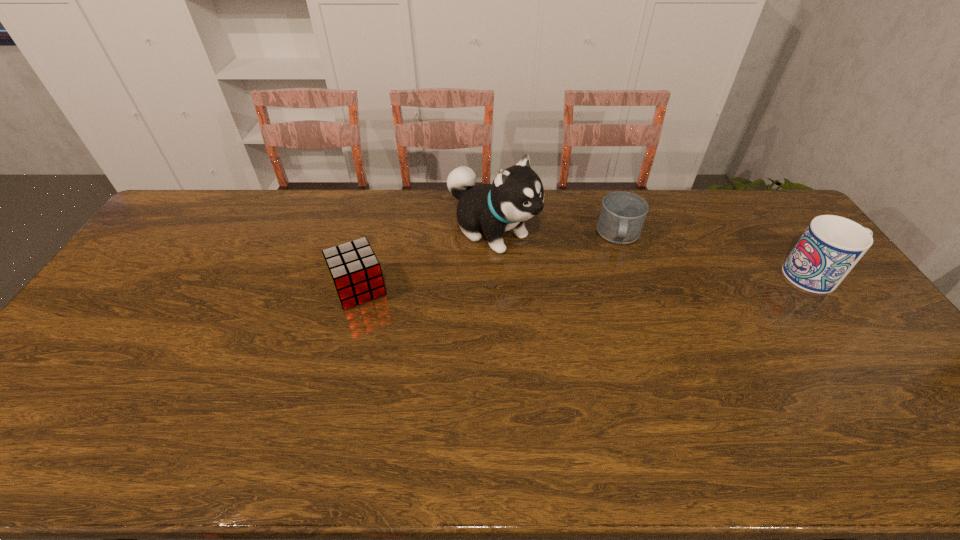
The width and height of the screenshot is (960, 540). In order to click on free space on the desktop that is between the cube and the taller mug and is positioned on the side of the farther mug with the handle in this screenshot , I will do [x=616, y=281].

Where is `free spot on the desktop that is between the cube and the second tallest object and is positioned at the face of the third object from right to left`? This screenshot has width=960, height=540. free spot on the desktop that is between the cube and the second tallest object and is positioned at the face of the third object from right to left is located at coordinates (571, 282).